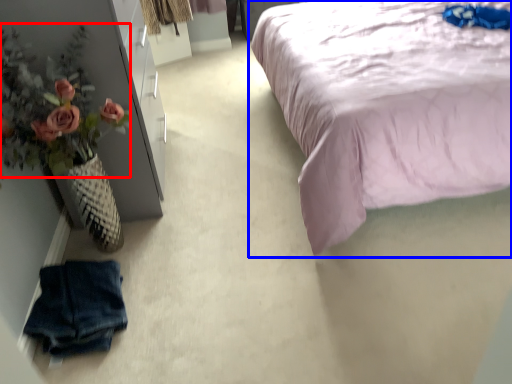
Question: Which point is further to the camera, floral arrangement (highlighted by a red box) or bed (highlighted by a blue box)?

Choices:
 (A) floral arrangement
 (B) bed

Answer: (A)